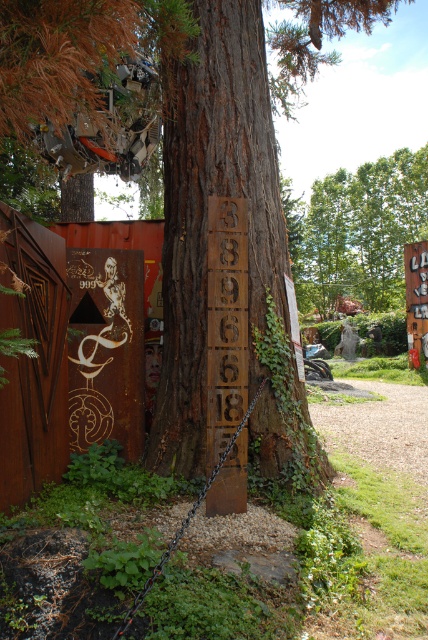
Question: Among these objects, which one is nearest to the camera?

Choices:
 (A) rusty metal sign at center
 (B) wooden sign at right
 (C) brown rough tree trunk at center
 (D) green leafy tree at upper center

Answer: (A)

Question: Which of the following is the closest to the observer?

Choices:
 (A) pyautogui.click(x=258, y=192)
 (B) pyautogui.click(x=306, y=236)
 (C) pyautogui.click(x=222, y=410)

Answer: (C)

Question: Does rusty metal sign at center have a smaller size compared to wooden sign at right?

Choices:
 (A) yes
 (B) no

Answer: (A)

Question: Can you confirm if brown rough tree trunk at center is smaller than green leafy tree at upper center?

Choices:
 (A) yes
 (B) no

Answer: (A)

Question: Among these objects, which one is nearest to the camera?

Choices:
 (A) wooden sign at right
 (B) green leafy tree at upper center
 (C) brown rough tree trunk at center
 (D) rusty metal sign at center

Answer: (D)

Question: Is brown rough tree trunk at center to the left of rusty metal sign at center from the viewer's perspective?

Choices:
 (A) yes
 (B) no

Answer: (B)